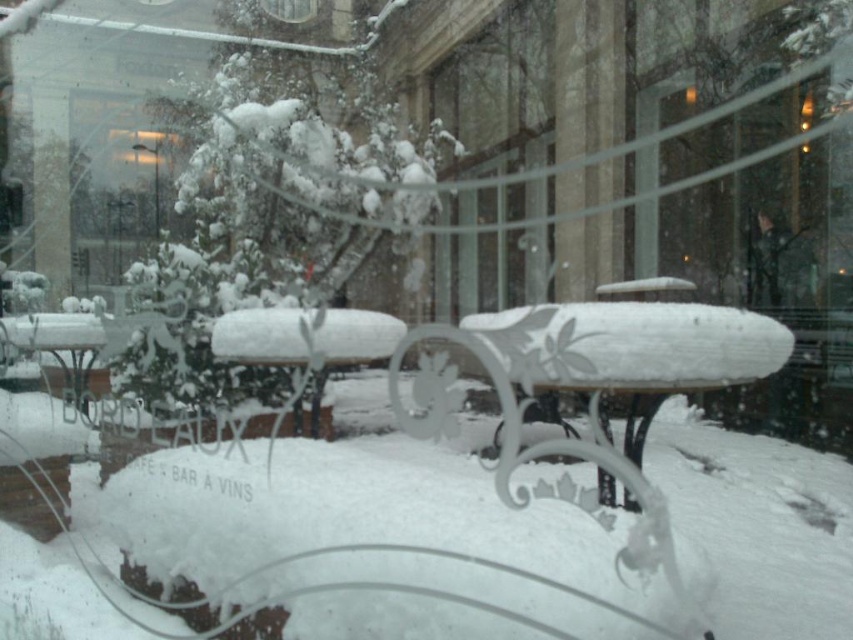
You are a customer in the winter scene and want to sit at the white frosted glass table at center and the white frosted table at center. Which one is located to the right side?

The white frosted glass table at center is positioned on the right side of the white frosted table at center.

You are a customer sitting inside the cafe and want to place your coffee on the table closest to the window. Which table should you choose between the white frosted glass table at center and the white frosted table at center?

You should choose the white frosted glass table at center because it is in front of the white frosted table at center, making it closer to the window.

You are a customer entering the winter scene and want to sit at the white frosted glass table at center and the white frosted table at center. Which one is taller?

The white frosted glass table at center is much taller as white frosted table at center.